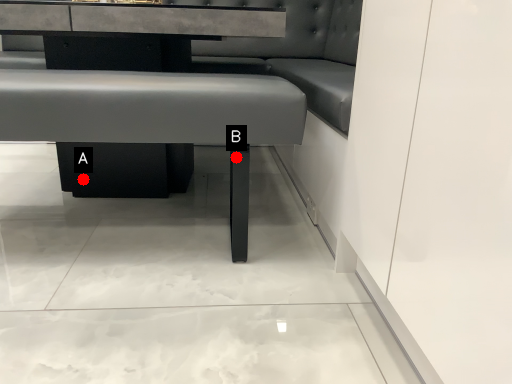
Question: Two points are circled on the image, labeled by A and B beside each circle. Which point appears farthest from the camera in this image?

Choices:
 (A) A is further
 (B) B is further

Answer: (A)